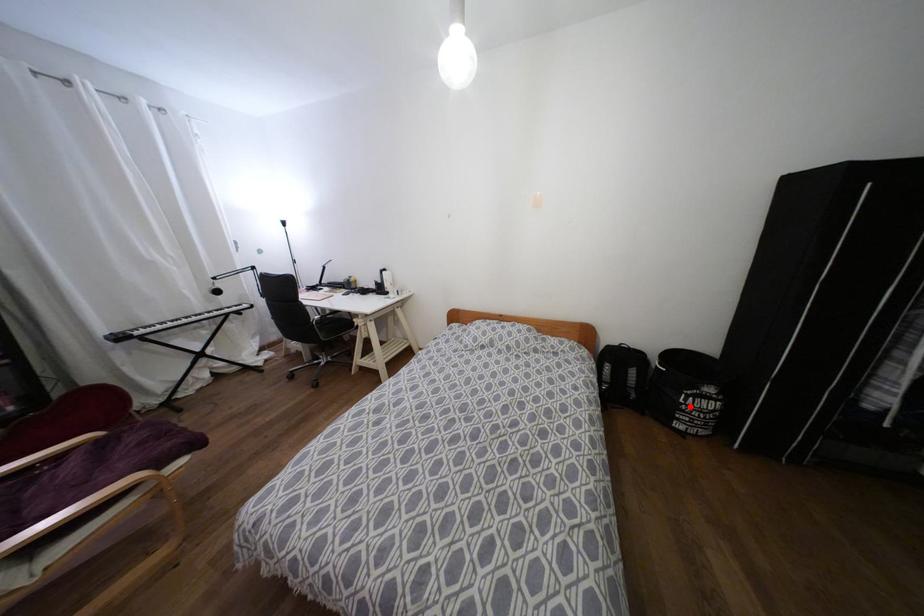
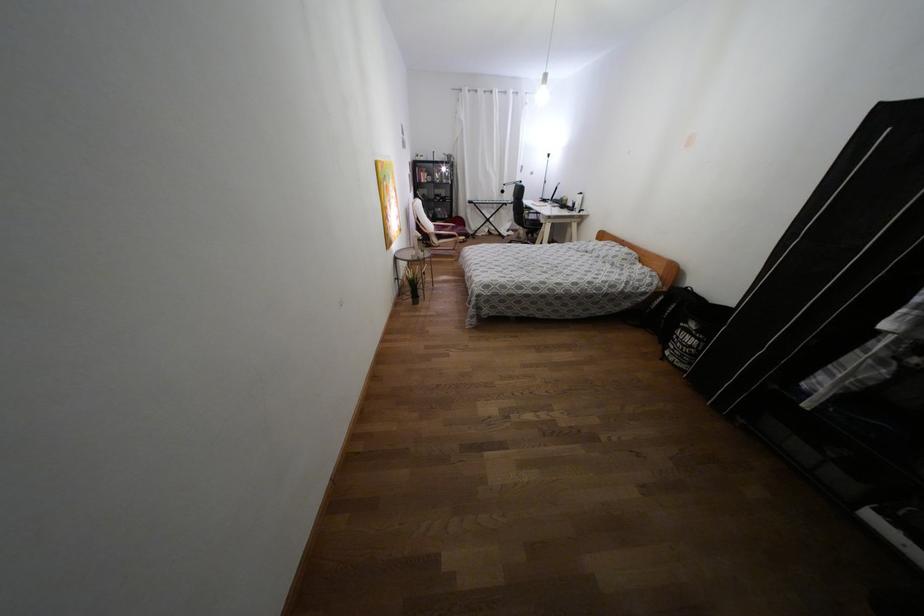
Question: I am providing you with two images of the same scene from different viewpoints. Image1 has a red point marked. In image2, the corresponding 3D location appears at what relative position? Reply with the corresponding letter.

Choices:
 (A) Closer
 (B) Farther

Answer: (A)